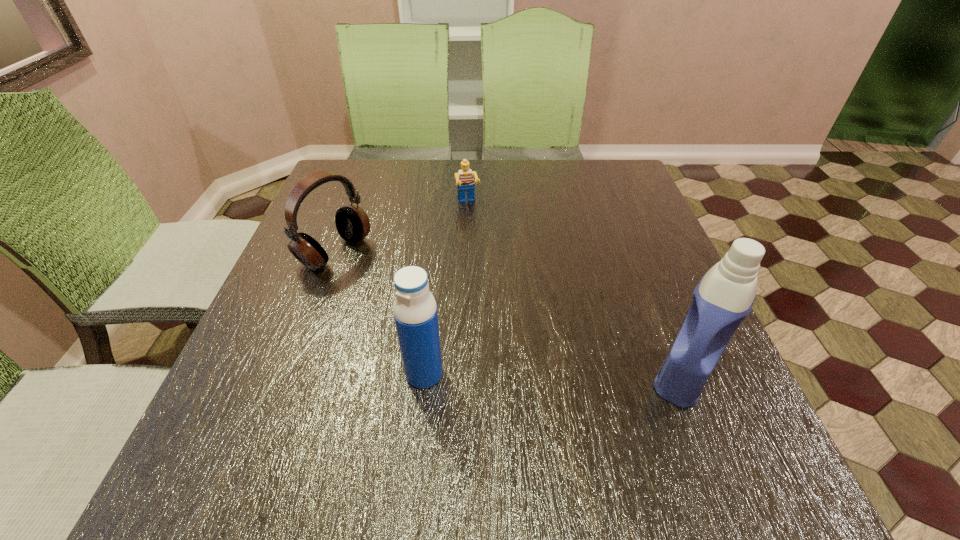
Find the location of `free area in between the second shortest object and the rightmost object`. free area in between the second shortest object and the rightmost object is located at coordinates (510, 314).

Find the location of `unoccupied position between the headset and the detergent`. unoccupied position between the headset and the detergent is located at coordinates (510, 314).

Image resolution: width=960 pixels, height=540 pixels. Find the location of `free area in between the shortest object and the detergent`. free area in between the shortest object and the detergent is located at coordinates (576, 289).

Locate an element on the screen. empty space that is in between the third object from right to left and the third nearest object is located at coordinates (380, 313).

Image resolution: width=960 pixels, height=540 pixels. I want to click on free point between the third object from right to left and the shortest object, so click(446, 289).

What are the coordinates of `vacant space that's between the leftmost object and the shortest object` in the screenshot? It's located at (401, 228).

The image size is (960, 540). What are the coordinates of `free space between the shortest object and the second tallest object` in the screenshot? It's located at (446, 289).

Choose which object is the nearest neighbor to the rightmost object. Please provide its 2D coordinates. Your answer should be formatted as a tuple, i.e. [(x, y)], where the tuple contains the x and y coordinates of a point satisfying the conditions above.

[(415, 312)]

At what (x,y) coordinates should I click in order to perform the action: click on object that stands as the second closest to the third object from left to right. Please return your answer as a coordinate pair (x, y). Looking at the image, I should click on (415, 312).

Where is `vacant position in the image that satisfies the following two spatial constraints: 1. on the front side of the tallest object; 2. on the left side of the third shortest object`? vacant position in the image that satisfies the following two spatial constraints: 1. on the front side of the tallest object; 2. on the left side of the third shortest object is located at coordinates (424, 375).